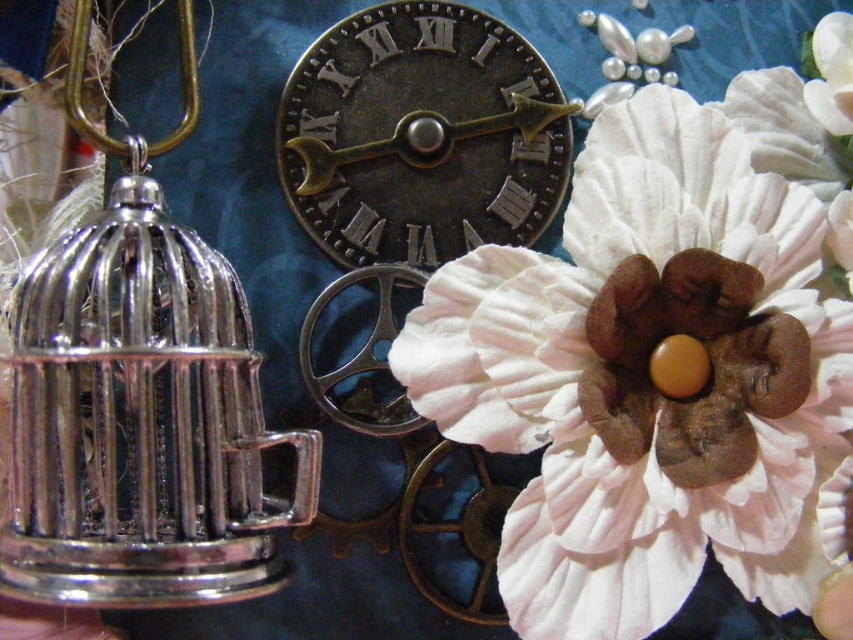
Can you confirm if white fabric flower at upper right is thinner than antique brass clock at center?

No.

Is white fabric flower at upper right above antique brass clock at center?

Actually, white fabric flower at upper right is below antique brass clock at center.

You are a GUI agent. You are given a task and a screenshot of the screen. Output one action in this format:
    pyautogui.click(x=<x>, y=<y>)
    Task: Click on the white fabric flower at upper right
    
    Given the screenshot: What is the action you would take?
    click(x=647, y=378)